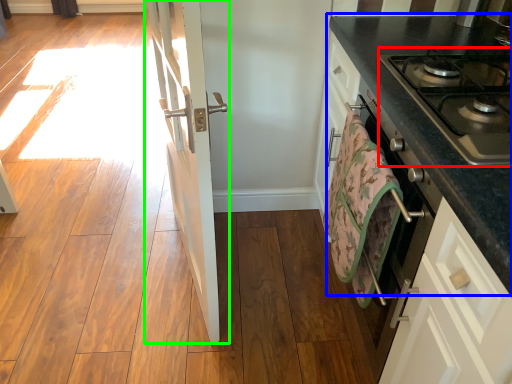
Question: Which object is positioned farthest from gas stove (highlighted by a red box)? Select from countertop (highlighted by a blue box) and door (highlighted by a green box).

Choices:
 (A) countertop
 (B) door

Answer: (B)